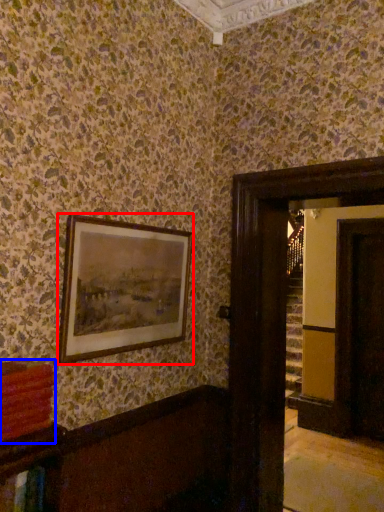
Question: Which of the following is the farthest to the observer, picture frame (highlighted by a red box) or book (highlighted by a blue box)?

Choices:
 (A) picture frame
 (B) book

Answer: (A)